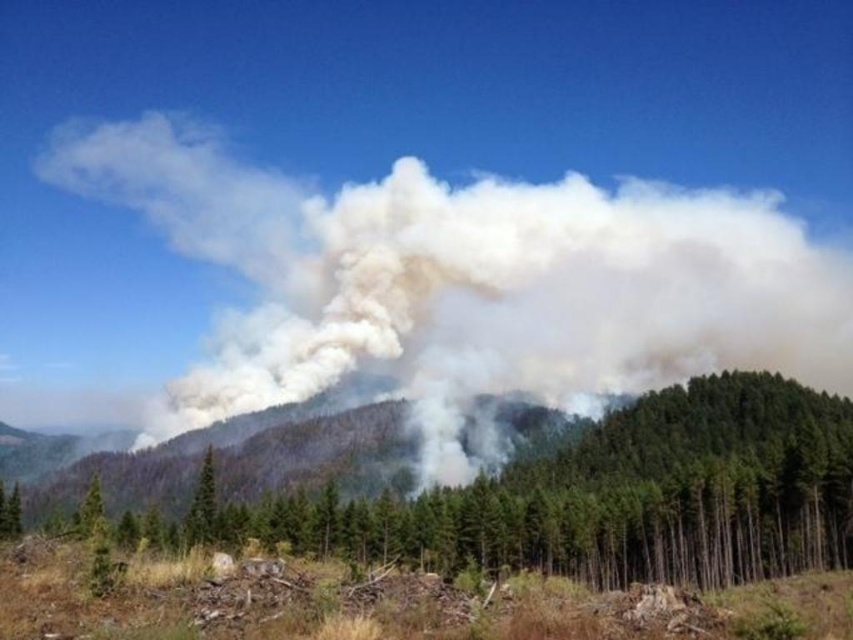
Question: Which point is closer to the camera taking this photo?

Choices:
 (A) (451, 440)
 (B) (350, 483)
 (C) (190, 524)

Answer: (C)

Question: Among these points, which one is nearest to the camera?

Choices:
 (A) (474, 371)
 (B) (201, 477)
 (C) (287, 474)

Answer: (B)

Question: Is the position of white smoke at center more distant than that of smoke-filled forest at center?

Choices:
 (A) no
 (B) yes

Answer: (B)

Question: Based on their relative distances, which object is nearer to the green textured pine tree at center?

Choices:
 (A) smoke-filled forest at center
 (B) white smoke at center

Answer: (A)

Question: Is smoke-filled forest at center wider than green textured pine tree at center?

Choices:
 (A) yes
 (B) no

Answer: (A)

Question: Does white smoke at center lie in front of green textured pine tree at center?

Choices:
 (A) no
 (B) yes

Answer: (A)